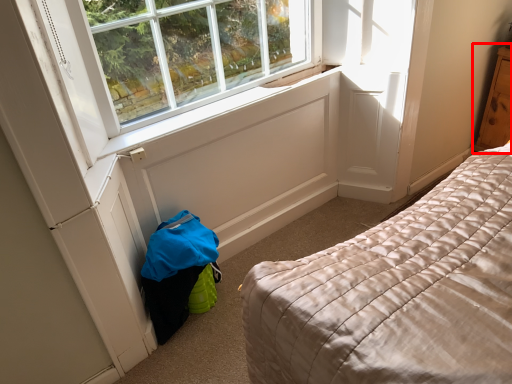
Question: From the image's perspective, what is the correct spatial relationship of dresser (annotated by the red box) in relation to window sill?

Choices:
 (A) above
 (B) below

Answer: (A)